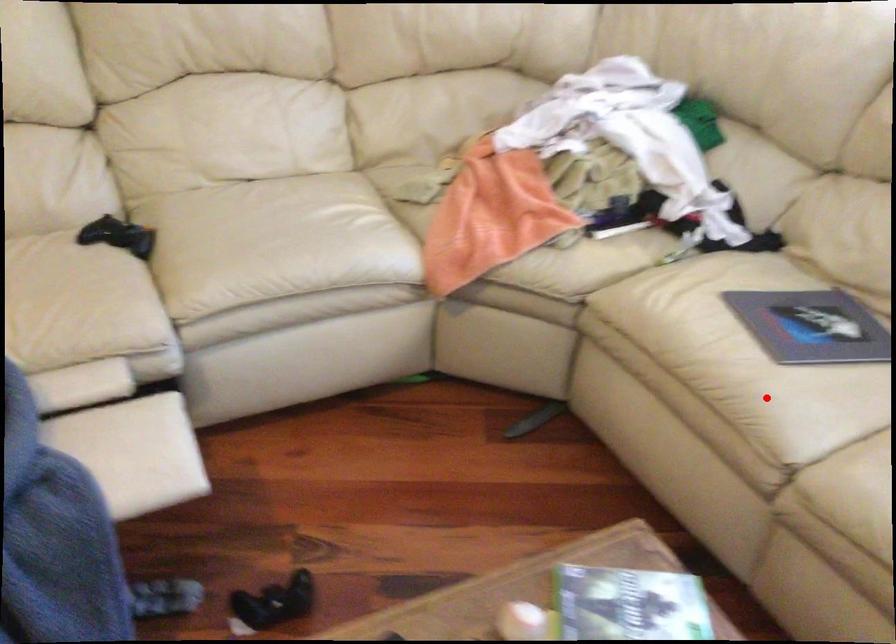
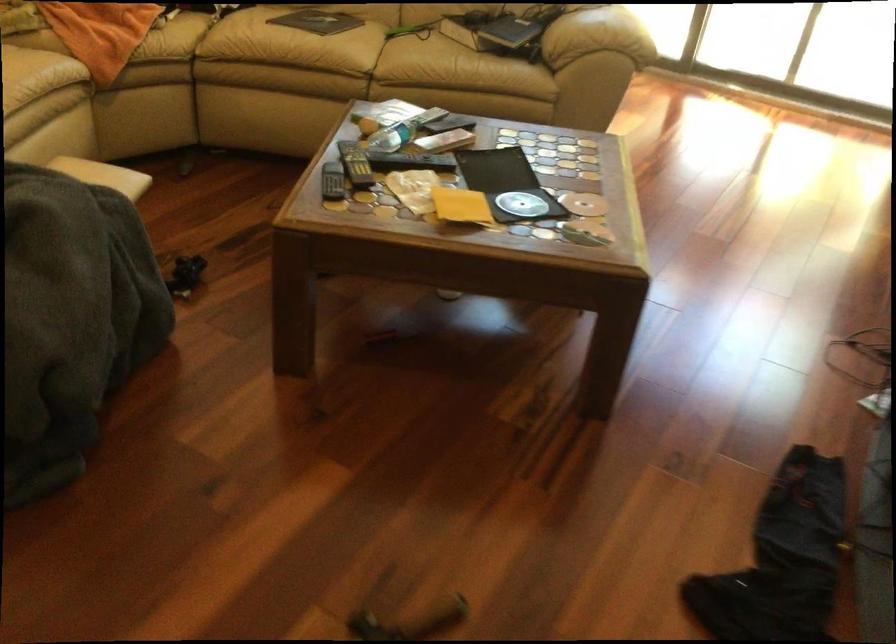
In the second image, find the point that corresponds to the highlighted location in the first image.

(334, 58)